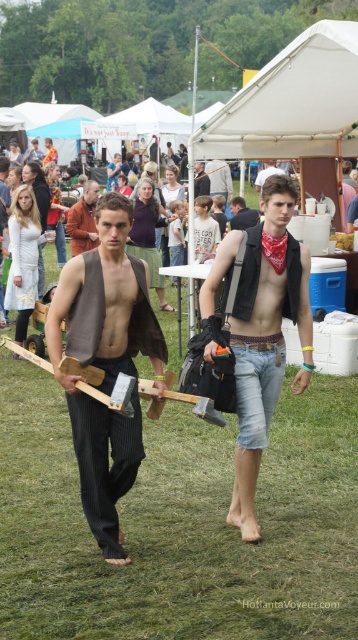
Question: Among these points, which one is nearest to the camera?

Choices:
 (A) (244, 216)
 (B) (86, 212)
 (C) (206, 458)

Answer: (C)

Question: Is matte brown vest at center bigger than brown leather jacket at center?

Choices:
 (A) yes
 (B) no

Answer: (A)

Question: Does green grass at center appear over brown leather jacket at center?

Choices:
 (A) no
 (B) yes

Answer: (A)

Question: Which point appears closest to the camera in this image?

Choices:
 (A) (205, 188)
 (B) (168, 403)

Answer: (B)

Question: Which object is the closest to the denim vest at center?

Choices:
 (A) green grass at center
 (B) brown leather jacket at center
 (C) denim shorts at center
 (D) white fabric canopy at upper center

Answer: (D)

Question: Observing the image, what is the correct spatial positioning of white fabric canopy at upper center in reference to dark brown leather jacket at center?

Choices:
 (A) left
 (B) right

Answer: (B)